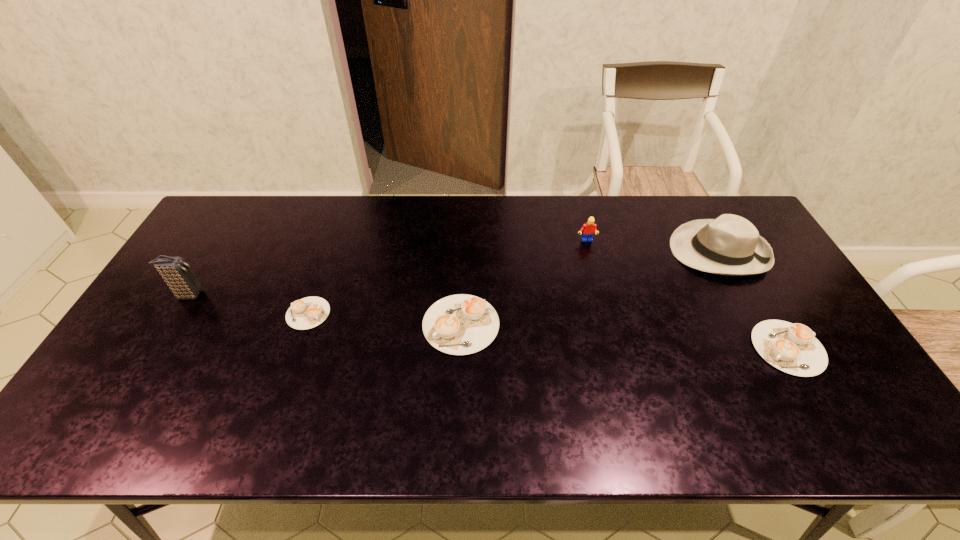
This screenshot has height=540, width=960. I want to click on vacant area situated on the left of the shortest object, so click(184, 313).

Where is `vacant space located 0.360m on the left of the third object from left to right`? vacant space located 0.360m on the left of the third object from left to right is located at coordinates coord(292,325).

You are a GUI agent. You are given a task and a screenshot of the screen. Output one action in this format:
    pyautogui.click(x=<x>, y=<y>)
    Task: Click on the free space located on the back of the second shortest object
    This screenshot has width=960, height=540.
    Given the screenshot: What is the action you would take?
    pyautogui.click(x=744, y=272)

The height and width of the screenshot is (540, 960). What are the coordinates of `blank space located 0.400m on the front-facing side of the fedora` in the screenshot? It's located at (547, 251).

I want to click on blank space located 0.300m on the front-facing side of the fedora, so click(x=578, y=251).

Locate an element on the screen. vacant space located on the front-facing side of the fedora is located at coordinates (547, 251).

Find the location of a particular element. vacant space located on the front-facing side of the fourth shortest object is located at coordinates (606, 318).

Locate an element on the screen. The image size is (960, 540). vacant space located 0.070m with the zip open on the leftmost object is located at coordinates (228, 294).

Where is `fedora that is at the far edge`? The width and height of the screenshot is (960, 540). fedora that is at the far edge is located at coordinates (730, 245).

You are a GUI agent. You are given a task and a screenshot of the screen. Output one action in this format:
    pyautogui.click(x=<x>, y=<y>)
    Task: Click on the Lego that is at the far edge
    
    Given the screenshot: What is the action you would take?
    pyautogui.click(x=589, y=229)